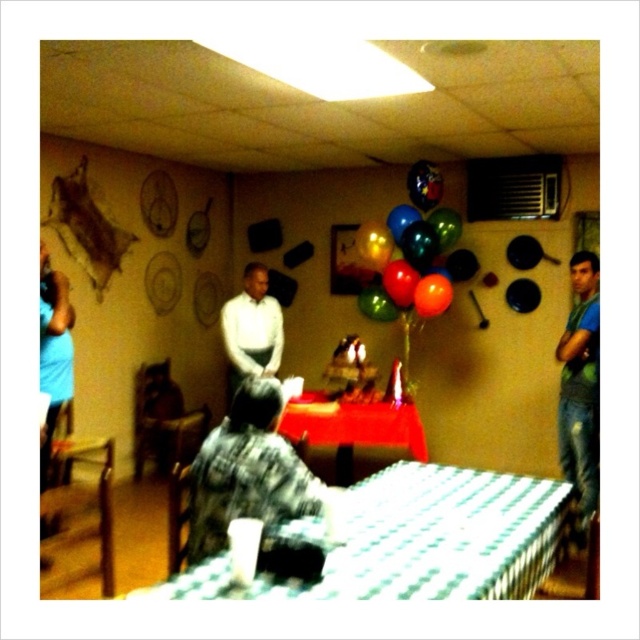
Question: Estimate the real-world distances between objects in this image. Which object is farther from the green t-shirt at right?

Choices:
 (A) shiny red tablecloth at center
 (B) flannel shirt at center
 (C) glossy metallic balloons at upper center

Answer: (B)

Question: Does multicolored balloons at center appear under white matte shirt at center?

Choices:
 (A) no
 (B) yes

Answer: (A)

Question: Which point is farther to the camera?

Choices:
 (A) shiny red tablecloth at center
 (B) green t-shirt at right
 (C) white checkered tablecloth at lower center

Answer: (A)

Question: Does flannel shirt at center appear under glossy metallic balloons at upper center?

Choices:
 (A) yes
 (B) no

Answer: (A)

Question: Which point appears closest to the camera in this image?

Choices:
 (A) (225, 326)
 (B) (525, 534)

Answer: (B)

Question: Is multicolored balloons at center smaller than green t-shirt at right?

Choices:
 (A) no
 (B) yes

Answer: (A)